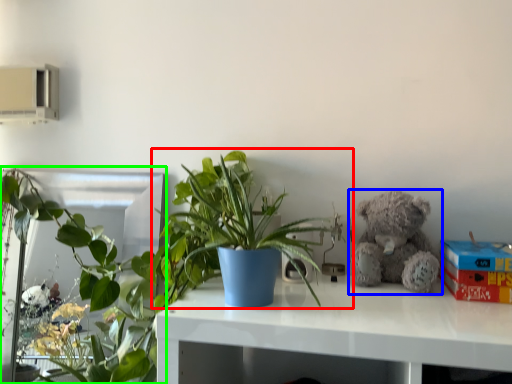
Question: Which object is the farthest from houseplant (highlighted by a red box)? Choose among these: teddy bear (highlighted by a blue box) or houseplant (highlighted by a green box).

Choices:
 (A) teddy bear
 (B) houseplant

Answer: (B)